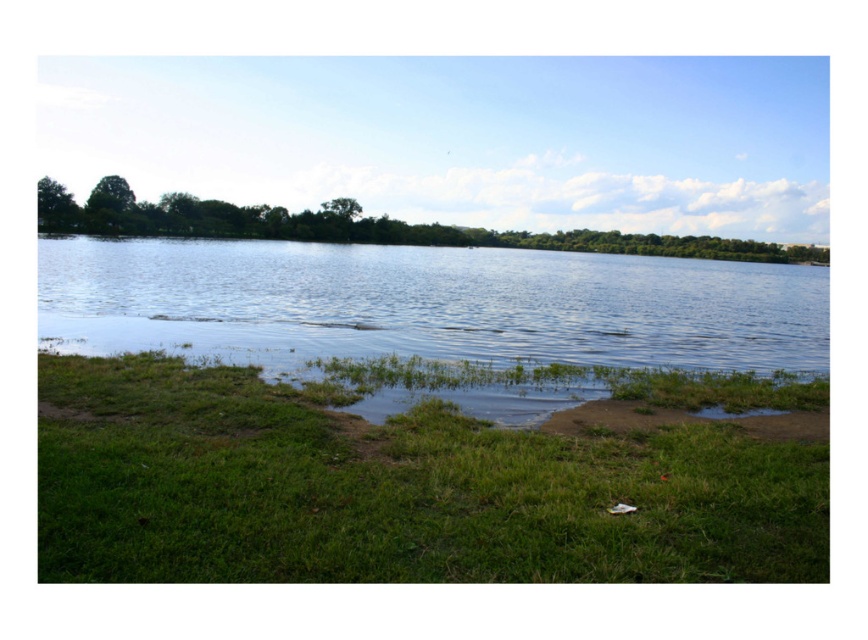
Question: Can you confirm if green grassy at lower left is thinner than clear water at center?

Choices:
 (A) no
 (B) yes

Answer: (B)

Question: Does green grassy at lower left appear on the left side of clear water at center?

Choices:
 (A) no
 (B) yes

Answer: (A)

Question: Which point appears closest to the camera in this image?

Choices:
 (A) (423, 456)
 (B) (274, 312)

Answer: (A)

Question: Among these points, which one is farthest from the camera?

Choices:
 (A) (698, 288)
 (B) (573, 513)

Answer: (A)

Question: Can you confirm if green grassy at lower left is positioned to the right of clear water at center?

Choices:
 (A) no
 (B) yes

Answer: (B)